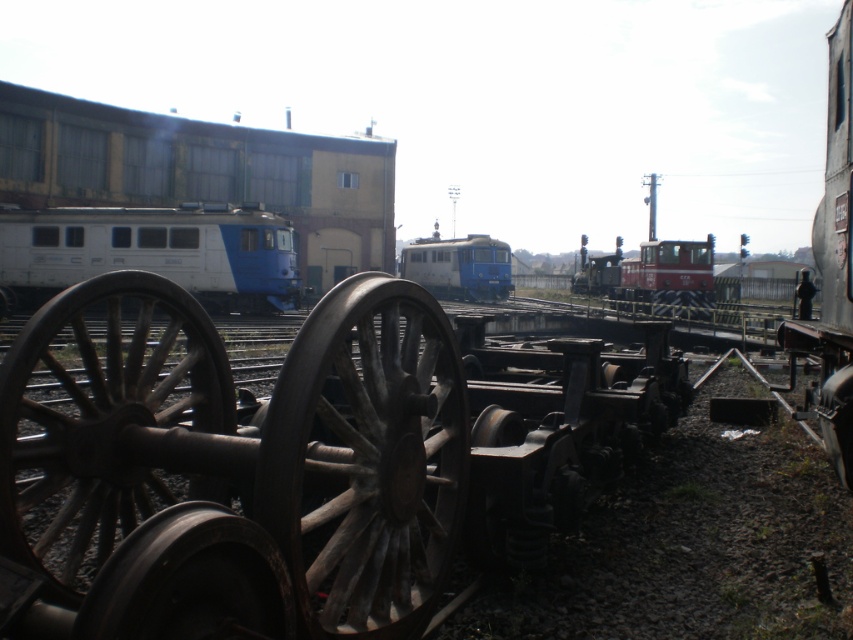
Question: From the image, what is the correct spatial relationship of rusty wood wheel at center in relation to white glossy train at left?

Choices:
 (A) left
 (B) right

Answer: (B)

Question: Can you confirm if white glossy train at left is positioned below light blue metallic locomotive at center?

Choices:
 (A) no
 (B) yes

Answer: (B)

Question: Which point appears closest to the camera in this image?

Choices:
 (A) (413, 266)
 (B) (433, 307)
 (C) (50, 337)
 (D) (218, 234)

Answer: (C)

Question: Among these objects, which one is nearest to the camera?

Choices:
 (A) white glossy train at left
 (B) red matte train at center
 (C) light blue metallic locomotive at center
 (D) rusty wood wheel at center

Answer: (D)

Question: Can you confirm if white glossy train at left is positioned above rusty metal train at right?

Choices:
 (A) yes
 (B) no

Answer: (A)

Question: Among these objects, which one is farthest from the camera?

Choices:
 (A) rusty metal wheel at lower left
 (B) white glossy train at left
 (C) red matte train at center

Answer: (C)